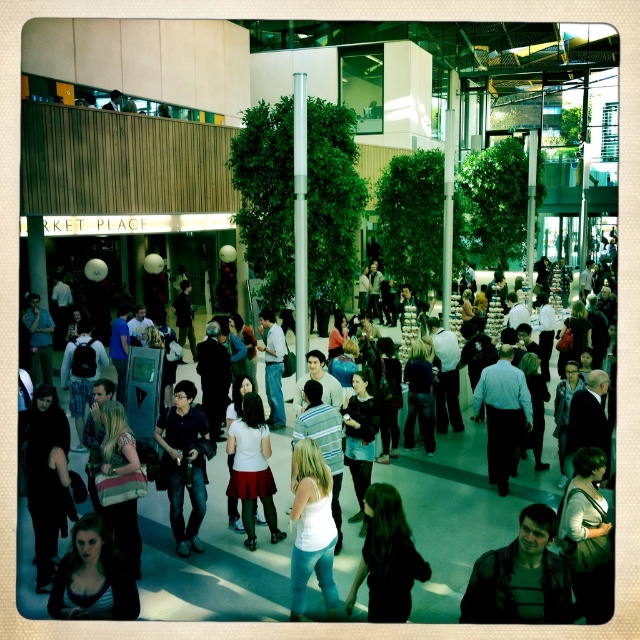
Question: Does matte black shirt at center have a smaller size compared to white matte skirt at center?

Choices:
 (A) yes
 (B) no

Answer: (A)

Question: Among these points, which one is farthest from the camera?

Choices:
 (A) (426, 579)
 (B) (92, 609)

Answer: (A)

Question: Which of the following is the farthest from the observer?

Choices:
 (A) white matte tank top at center
 (B) black fabric dress at center
 (C) striped fabric shirt at lower left
 (D) matte black jacket at lower right

Answer: (A)

Question: Is white matte tank top at center in front of matte black shirt at center?

Choices:
 (A) no
 (B) yes

Answer: (B)

Question: Which of the following is the farthest from the observer?

Choices:
 (A) matte black jacket at lower right
 (B) white matte tank top at center
 (C) black fabric dress at center

Answer: (B)

Question: Does light blue shirt at center have a lesser width compared to white matte skirt at center?

Choices:
 (A) no
 (B) yes

Answer: (A)